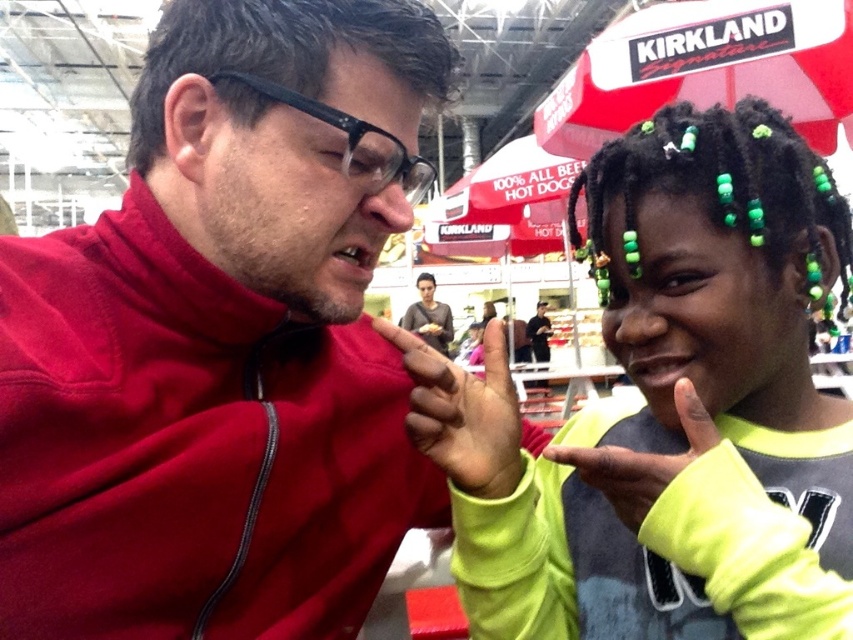
You are a photographer trying to capture a portrait of the two people in the image. You want to ensure that both the neon green sweater at center and the smooth skin face at center are clearly visible in the photo. Based on their positions, which object should you focus on first to ensure both are in sharp focus?

The neon green sweater at center is positioned on the right side of smooth skin face at center, so focusing on the smooth skin face at center first will ensure both are in sharp focus since it is closer to the camera.

You are a photographer trying to capture a candid shot of both the matte red jacket at center and the smooth skin face at center in the scene. Based on their positions, which object should you focus on first to ensure both are in frame?

The matte red jacket at center is not as tall as smooth skin face at center, so you should focus on the smooth skin face at center first to ensure both are in frame.

You are a photographer standing 1 meter away from the scene. You want to take a closeup shot of the neon green sweater at center without including the surrounding people. Is the sweater within your camera lens range if the lens can focus as close as 50 centimeters?

The neon green sweater at center is 44.73 centimeters from camera, so yes, it is within the camera lens range since it is closer than the 50 centimeter minimum focus distance.